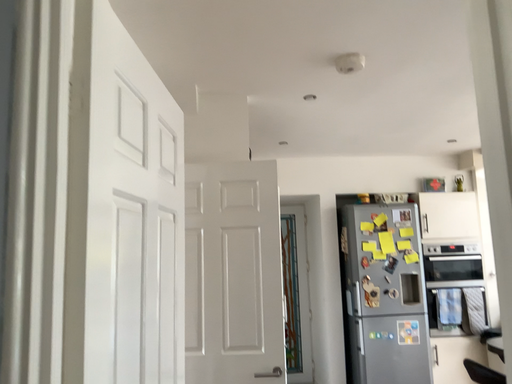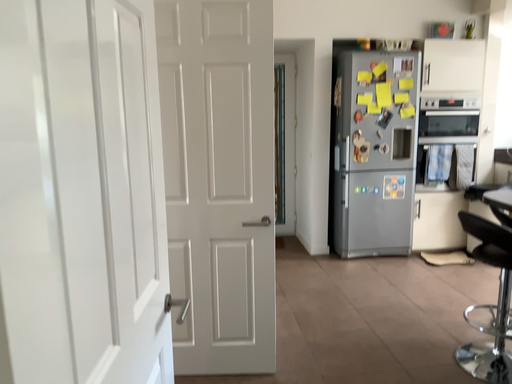
Question: How did the camera likely rotate when shooting the video?

Choices:
 (A) rotated downward
 (B) rotated upward

Answer: (A)